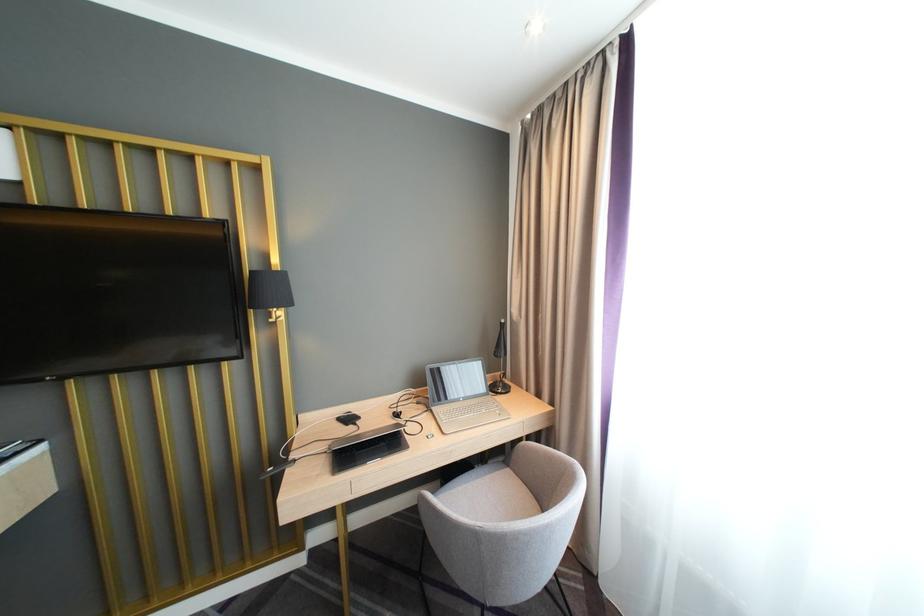
You are a GUI agent. You are given a task and a screenshot of the screen. Output one action in this format:
    pyautogui.click(x=<x>, y=<y>)
    Task: Click on the black power adapter
    This screenshot has height=616, width=924.
    Given the screenshot: What is the action you would take?
    pyautogui.click(x=500, y=362)